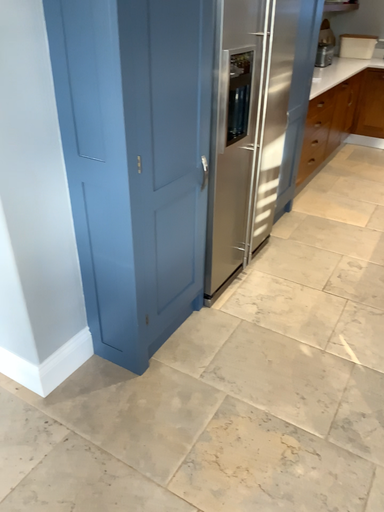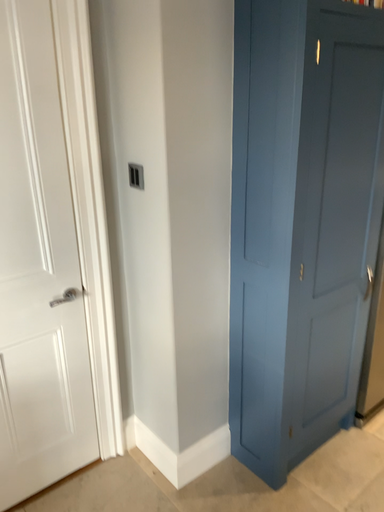
Question: Which way did the camera rotate in the video?

Choices:
 (A) rotated right
 (B) rotated left

Answer: (B)